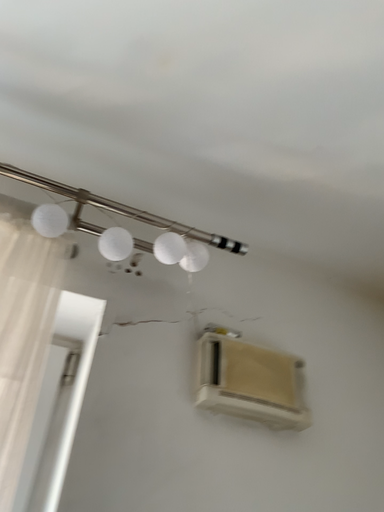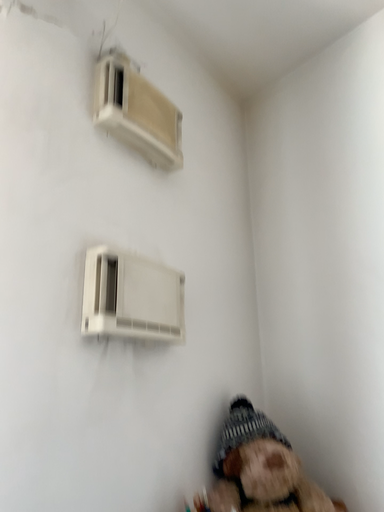
Question: How did the camera likely rotate when shooting the video?

Choices:
 (A) rotated right
 (B) rotated left

Answer: (A)